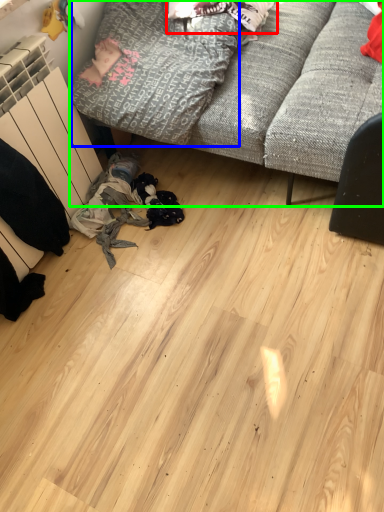
Question: Based on their relative distances, which object is nearer to clothing (highlighted by a red box)? Choose from clothing (highlighted by a blue box) and studio couch (highlighted by a green box).

Choices:
 (A) clothing
 (B) studio couch

Answer: (A)